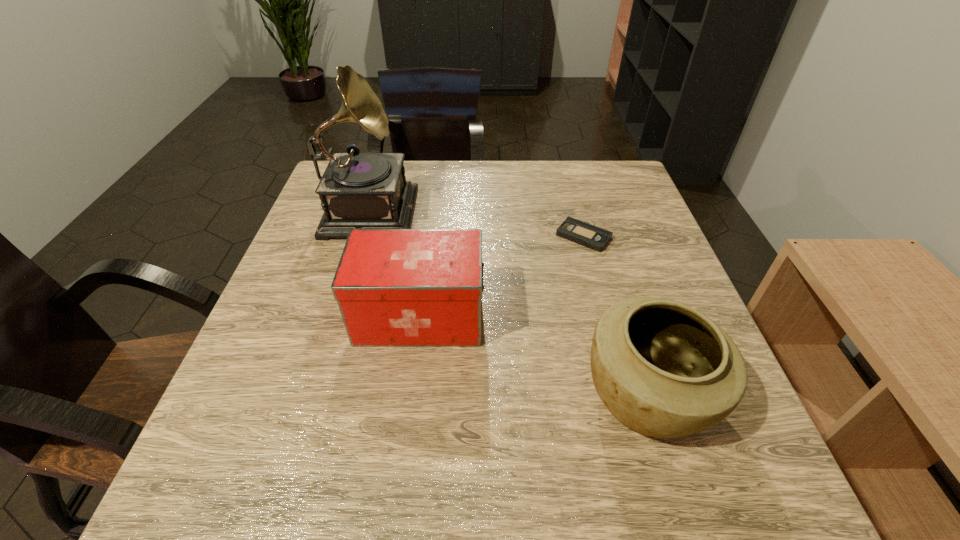
You are a GUI agent. You are given a task and a screenshot of the screen. Output one action in this format:
    pyautogui.click(x=<x>, y=<y>)
    Task: Click on the free spot that satisfies the following two spatial constraints: 1. on the horn of the pottery; 2. on the right side of the record player
    The image size is (960, 540).
    Given the screenshot: What is the action you would take?
    pyautogui.click(x=312, y=395)

This screenshot has width=960, height=540. Identify the location of free spot that satisfies the following two spatial constraints: 1. on the back side of the pottery; 2. on the handle side of the first-aid kit. (623, 316).

Image resolution: width=960 pixels, height=540 pixels. I want to click on vacant region that satisfies the following two spatial constraints: 1. on the horn of the record player; 2. on the back side of the pottery, so click(x=312, y=395).

At what (x,y) coordinates should I click in order to perform the action: click on free spot that satisfies the following two spatial constraints: 1. on the horn of the tallest object; 2. on the right side of the pottery. Please return your answer as a coordinate pair (x, y). Looking at the image, I should click on 312,395.